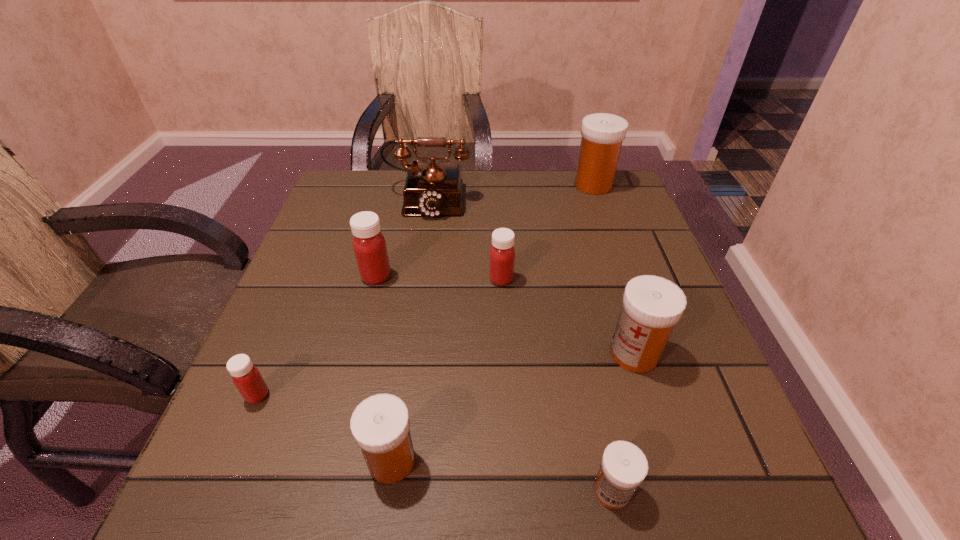
You are a GUI agent. You are given a task and a screenshot of the screen. Output one action in this format:
    pyautogui.click(x=<x>, y=<y>)
    Task: Click on the biggest white medicine
    This screenshot has width=960, height=540.
    Given the screenshot: What is the action you would take?
    pyautogui.click(x=602, y=134)

The height and width of the screenshot is (540, 960). Find the location of `the farthest white medicine`. the farthest white medicine is located at coordinates (602, 134).

Where is `brown telephone`? This screenshot has width=960, height=540. brown telephone is located at coordinates (432, 189).

This screenshot has height=540, width=960. In order to click on the second medicine from left to right in this screenshot , I will do `click(369, 245)`.

Image resolution: width=960 pixels, height=540 pixels. I want to click on the biggest red medicine, so click(x=369, y=245).

This screenshot has height=540, width=960. Find the location of `the fourth nearest medicine`. the fourth nearest medicine is located at coordinates (651, 305).

Find the location of a particular element. The width and height of the screenshot is (960, 540). the fifth farthest object is located at coordinates (651, 305).

Identify the location of the fourth medicine from right to left. This screenshot has width=960, height=540. (502, 253).

The width and height of the screenshot is (960, 540). I want to click on the rightmost red medicine, so click(502, 253).

Locate an element on the screen. The height and width of the screenshot is (540, 960). the third medicine from left to right is located at coordinates (380, 424).